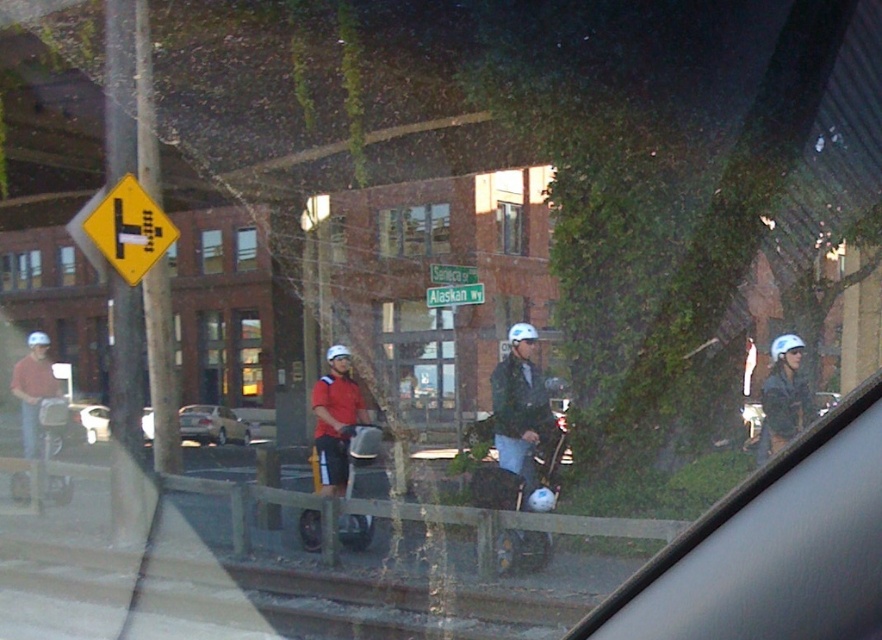
You are a delivery driver who needs to read the text on the green plastic street sign at center and the white matte safety helmet at upper right. Which object will you need to look closer at to read its text?

The white matte safety helmet at upper right is smaller than the green plastic street sign at center, so you will need to look closer at the white matte safety helmet at upper right to read its text.

You are a delivery driver in a gold metallic sedan at center and need to pick up a package from a rider wearing a white matte safety helmet at upper right. Can you tell if your car is smaller than the helmet in size?

The gold metallic sedan at center occupies less space than the white matte safety helmet at upper right, so yes, the car is smaller than the helmet in size.